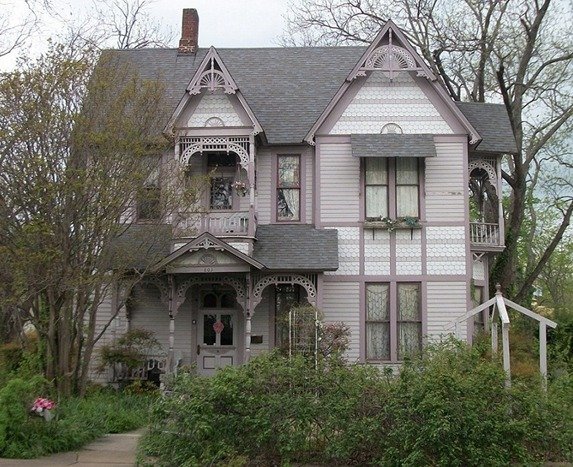
Image resolution: width=573 pixels, height=467 pixels. I want to click on brick chimney, so click(x=190, y=28).